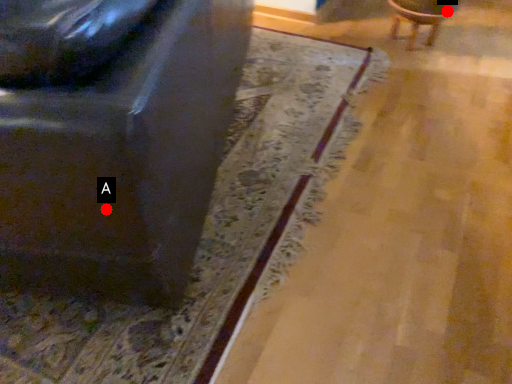
Question: Two points are circled on the image, labeled by A and B beside each circle. Which point is farther from the camera taking this photo?

Choices:
 (A) A is further
 (B) B is further

Answer: (B)